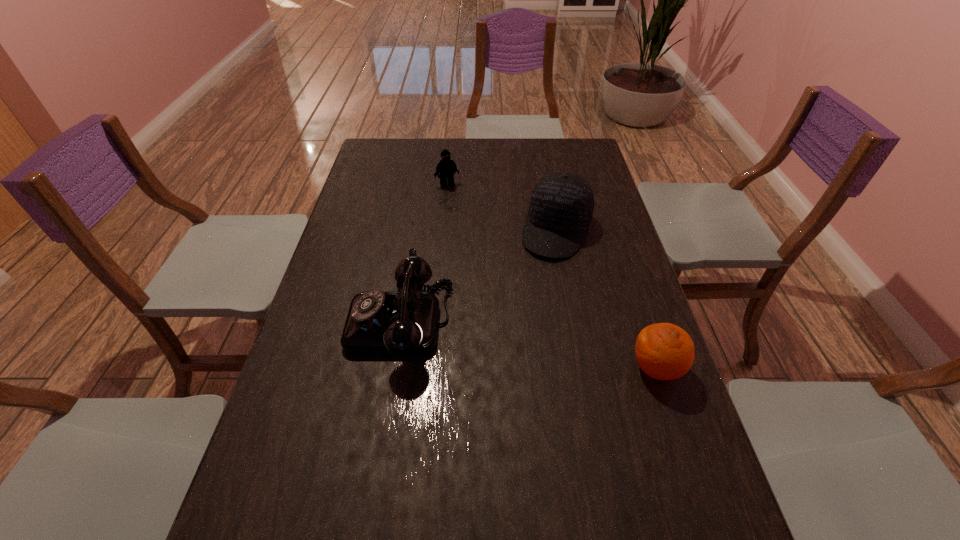
The height and width of the screenshot is (540, 960). Identify the location of vacant area situated 0.370m at the front of the third nearest object where the brim is located. (510, 355).

Identify the location of blank area located at the front of the third nearest object where the brim is located. This screenshot has width=960, height=540. (528, 309).

You are a GUI agent. You are given a task and a screenshot of the screen. Output one action in this format:
    pyautogui.click(x=<x>, y=<y>)
    Task: Click on the free region located at the front of the third nearest object where the brim is located
    Image resolution: width=960 pixels, height=540 pixels.
    Given the screenshot: What is the action you would take?
    pyautogui.click(x=523, y=322)

This screenshot has width=960, height=540. I want to click on object that is positioned at the left edge, so 405,323.

I want to click on orange present at the right edge, so click(x=664, y=351).

At what (x,y) coordinates should I click in order to perform the action: click on baseball cap positioned at the right edge. Please return your answer as a coordinate pair (x, y). The image size is (960, 540). Looking at the image, I should click on (561, 206).

Where is `vacant space at the far edge of the desktop`? vacant space at the far edge of the desktop is located at coordinates pyautogui.click(x=434, y=145).

Identify the location of free region at the near edge of the desktop. Image resolution: width=960 pixels, height=540 pixels. (520, 492).

The image size is (960, 540). In the image, there is a desktop. What are the coordinates of `blank space at the left edge` in the screenshot? It's located at (346, 368).

The height and width of the screenshot is (540, 960). I want to click on vacant area at the right edge, so click(622, 305).